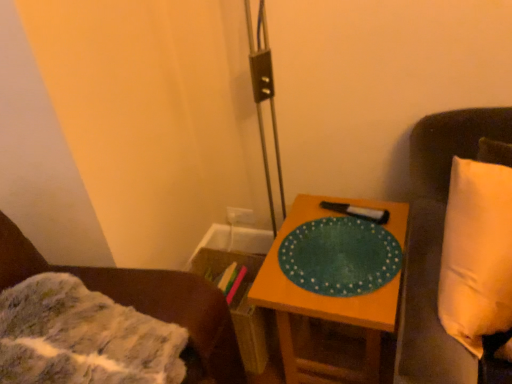
Question: Can you confirm if white fabric pillow at right, which is the 1th furniture in right-to-left order, is bigger than green matte placemat at center?

Choices:
 (A) no
 (B) yes

Answer: (B)

Question: From a real-world perspective, is white fabric pillow at right, which is the 1th furniture in right-to-left order, physically above green matte placemat at center?

Choices:
 (A) no
 (B) yes

Answer: (B)

Question: Does white fabric pillow at right, which ranks as the second furniture in left-to-right order, come behind green matte placemat at center?

Choices:
 (A) yes
 (B) no

Answer: (B)

Question: From a real-world perspective, does white fabric pillow at right, which is the 1th furniture in right-to-left order, sit lower than green matte placemat at center?

Choices:
 (A) no
 (B) yes

Answer: (A)

Question: Can you confirm if white fabric pillow at right, which ranks as the second furniture in left-to-right order, is wider than green matte placemat at center?

Choices:
 (A) no
 (B) yes

Answer: (A)

Question: Can we say white fabric pillow at right, which ranks as the second furniture in left-to-right order, lies outside green matte placemat at center?

Choices:
 (A) yes
 (B) no

Answer: (A)

Question: Can you confirm if white fabric pillow at right, which is the 1th furniture in right-to-left order, is taller than fuzzy fabric blanket at lower left, which appears as the 2th furniture when viewed from the right?

Choices:
 (A) no
 (B) yes

Answer: (B)

Question: Is white fabric pillow at right, which ranks as the second furniture in left-to-right order, in front of fuzzy fabric blanket at lower left, which appears as the 1th furniture when viewed from the left?

Choices:
 (A) yes
 (B) no

Answer: (B)

Question: Is white fabric pillow at right, which is the 1th furniture in right-to-left order, oriented away from fuzzy fabric blanket at lower left, which appears as the 2th furniture when viewed from the right?

Choices:
 (A) no
 (B) yes

Answer: (A)

Question: From the image's perspective, does white fabric pillow at right, which ranks as the second furniture in left-to-right order, appear higher than fuzzy fabric blanket at lower left, which appears as the 2th furniture when viewed from the right?

Choices:
 (A) yes
 (B) no

Answer: (A)

Question: Is white fabric pillow at right, which is the 1th furniture in right-to-left order, directly adjacent to fuzzy fabric blanket at lower left, which appears as the 1th furniture when viewed from the left?

Choices:
 (A) yes
 (B) no

Answer: (B)

Question: From a real-world perspective, is white fabric pillow at right, which ranks as the second furniture in left-to-right order, positioned over fuzzy fabric blanket at lower left, which appears as the 2th furniture when viewed from the right, based on gravity?

Choices:
 (A) no
 (B) yes

Answer: (A)

Question: Does green matte placemat at center have a lesser width compared to fuzzy fabric blanket at lower left, which appears as the 2th furniture when viewed from the right?

Choices:
 (A) yes
 (B) no

Answer: (A)